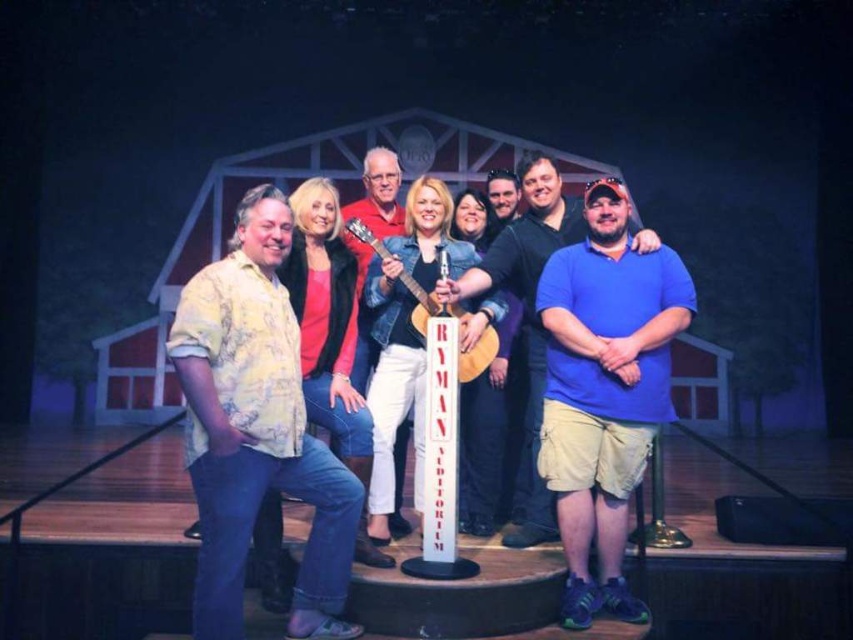
Question: Which of the following is the closest to the observer?

Choices:
 (A) yellow floral shirt at left
 (B) wooden acoustic guitar at center
 (C) matte red shirt at center

Answer: (A)

Question: Which is farther from the wooden acoustic guitar at center?

Choices:
 (A) matte red shirt at center
 (B) blue cotton shirt at center
 (C) yellow floral shirt at left

Answer: (C)

Question: Which point is farther from the camera taking this photo?

Choices:
 (A) (426, 305)
 (B) (538, 412)

Answer: (B)

Question: Is blue cotton shirt at center positioned behind wooden acoustic guitar at center?

Choices:
 (A) no
 (B) yes

Answer: (B)

Question: Is blue cotton shirt at center to the right of wooden acoustic guitar at center from the viewer's perspective?

Choices:
 (A) yes
 (B) no

Answer: (A)

Question: In this image, where is yellow floral shirt at left located relative to blue cotton shirt at center?

Choices:
 (A) below
 (B) above

Answer: (A)